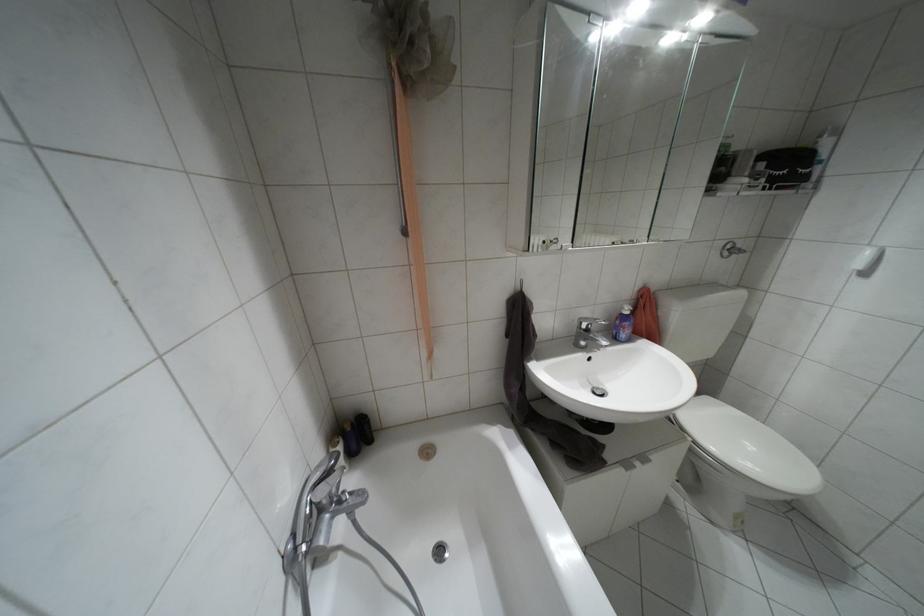
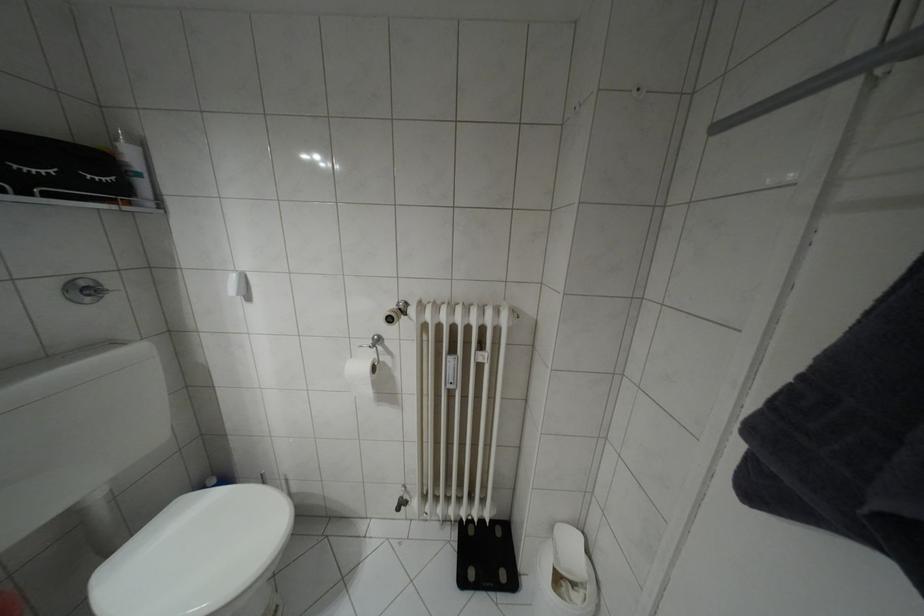
Where in the second image is the point corresponding to the point at 727,245 from the first image?

(81, 284)